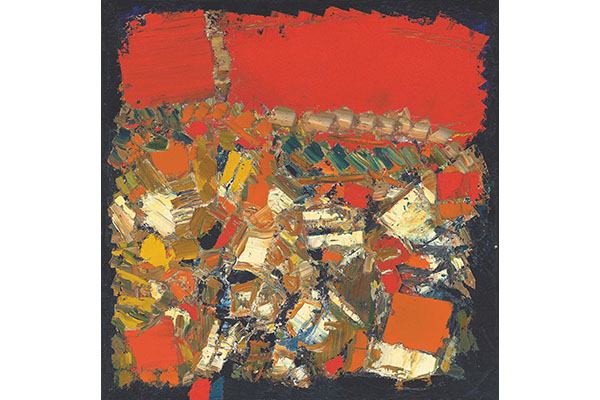
Where is `red paint`? red paint is located at coordinates (446, 73).